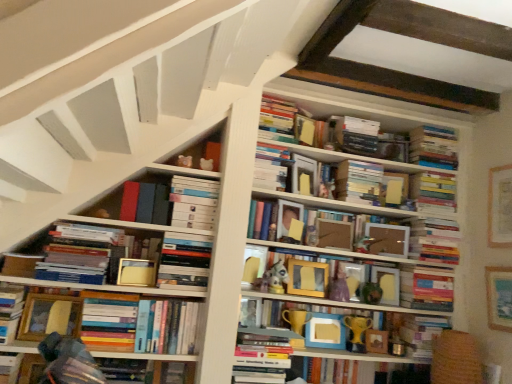
Question: In terms of width, does matte gold trophy at center, which appears as the 12th book when viewed from the top, look wider or thinner when compared to wooden picture frame at center, arranged as the 2th picture frame when viewed from the left?

Choices:
 (A) wide
 (B) thin

Answer: (A)

Question: Considering their positions, is matte gold trophy at center, which appears as the 5th book when ordered from the bottom, located in front of or behind wooden picture frame at center, arranged as the 2th picture frame when viewed from the left?

Choices:
 (A) front
 (B) behind

Answer: (A)

Question: Based on their relative distances, which object is nearer to the hardcover book at lower left, the fifteenth book in the top-to-bottom sequence?

Choices:
 (A) wooden picture frame at right, the fourth picture frame from the left
 (B) wooden frame at center, the eighth book from the bottom
 (C) hardcover books at center, positioned as the eighth book in top-to-bottom order
 (D) hardcover book at upper center, which ranks as the third paperback book in front-to-back order
 (E) hardcover books at upper right, acting as the thirteenth book starting from the bottom

Answer: (C)

Question: Estimate the real-world distances between objects in this image. Which object is closer to the wooden picture frame at right, which appears as the 2th picture frame when viewed from the right?

Choices:
 (A) hardcover book at lower left, the fifteenth book in the top-to-bottom sequence
 (B) wooden frame at center, arranged as the ninth book when viewed from the top
 (C) hardcover books at center, positioned as the eighth book in top-to-bottom order
 (D) white matte bookshelf at center, acting as the 14th book starting from the bottom
 (E) gold plastic trophy at center, placed as the second toy when sorted from top to bottom

Answer: (B)